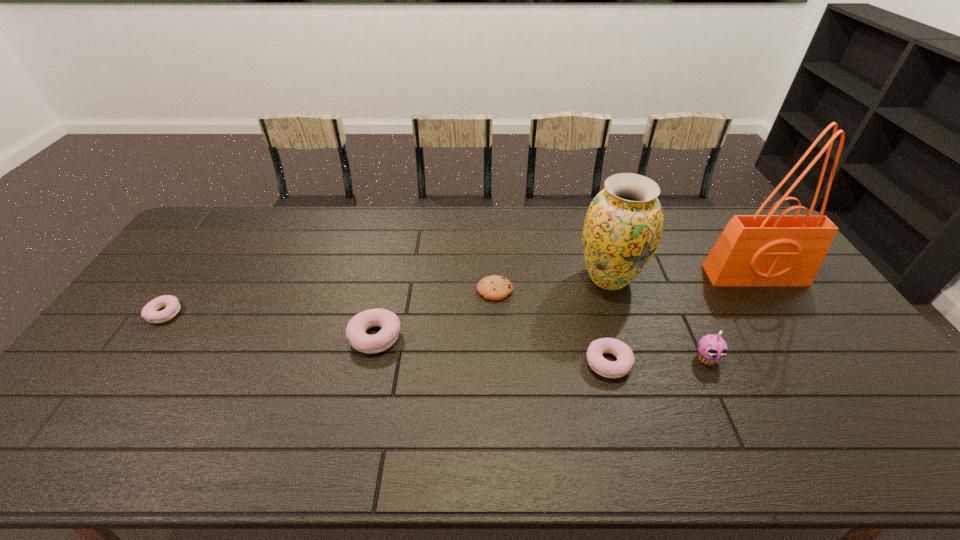
Where is `cupcake`? The width and height of the screenshot is (960, 540). cupcake is located at coordinates click(x=711, y=348).

The height and width of the screenshot is (540, 960). What are the coordinates of `tote bag` in the screenshot? It's located at (769, 250).

Image resolution: width=960 pixels, height=540 pixels. Find the location of `the rightmost object`. the rightmost object is located at coordinates (769, 250).

Locate an element on the screen. free point located on the front of the leftmost object is located at coordinates (113, 386).

I want to click on vacant space located 0.340m on the back of the second doughnut from left to right, so click(x=396, y=245).

The image size is (960, 540). In order to click on vacant position located 0.140m on the back of the second tallest doughnut in this screenshot , I will do `click(594, 308)`.

Find the location of a particular element. The width and height of the screenshot is (960, 540). vacant space situated on the left of the second tallest object is located at coordinates (494, 278).

The image size is (960, 540). I want to click on blank space located on the left of the fifth object from right to left, so click(460, 290).

In order to click on vacant region located on the face of the cupcake in this screenshot , I will do `click(721, 388)`.

What are the coordinates of `vacant space located on the logo side of the rightmost object` in the screenshot? It's located at (805, 351).